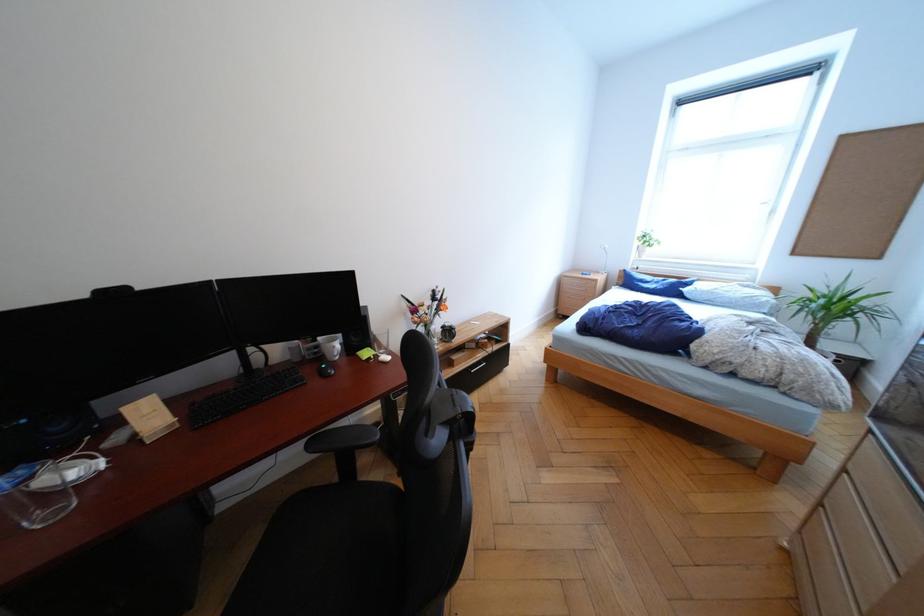
The image size is (924, 616). What do you see at coordinates (767, 204) in the screenshot?
I see `a white window handle` at bounding box center [767, 204].